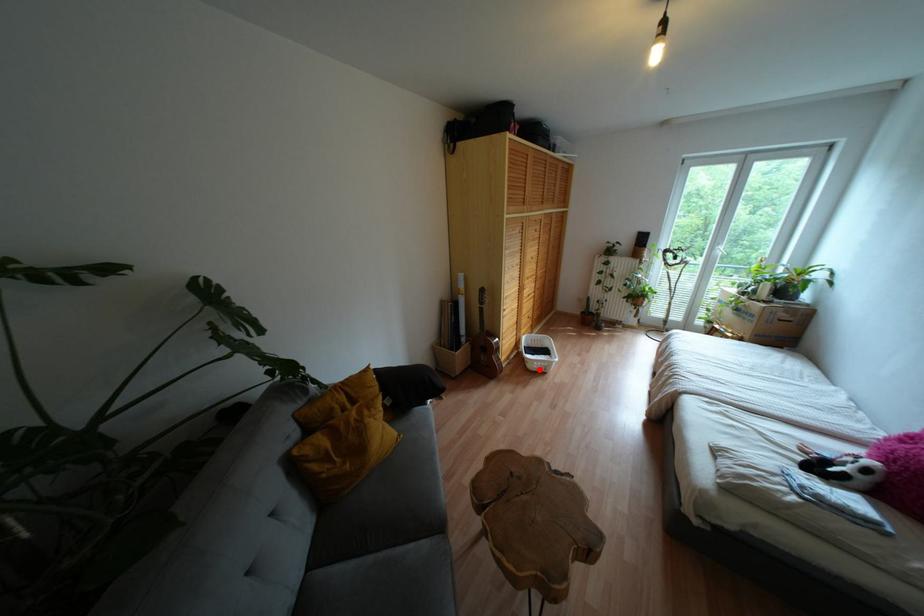
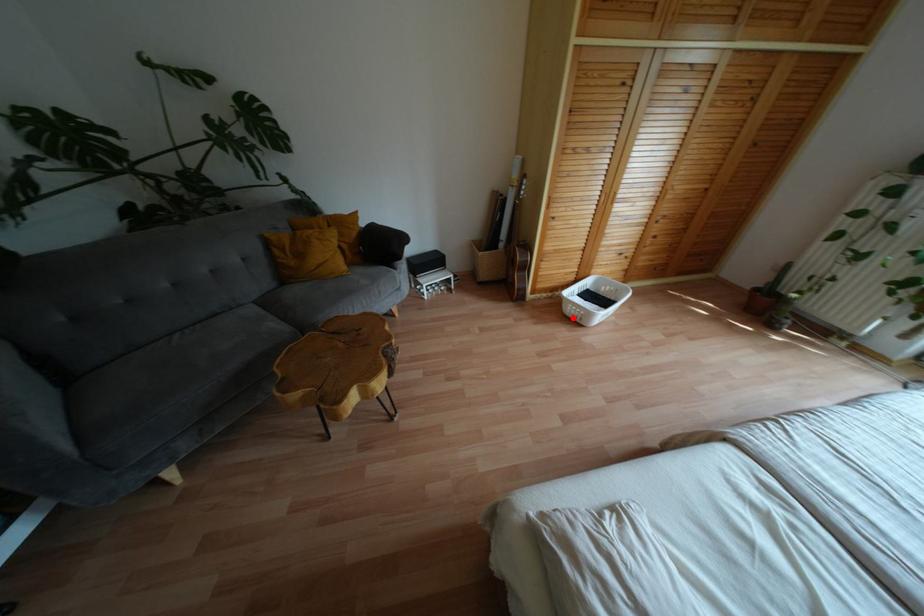
I am providing you with two images of the same scene from different viewpoints. A red point is marked on the first image and another point is marked on the second image. Is the marked point in image1 the same physical position as the marked point in image2?

Yes